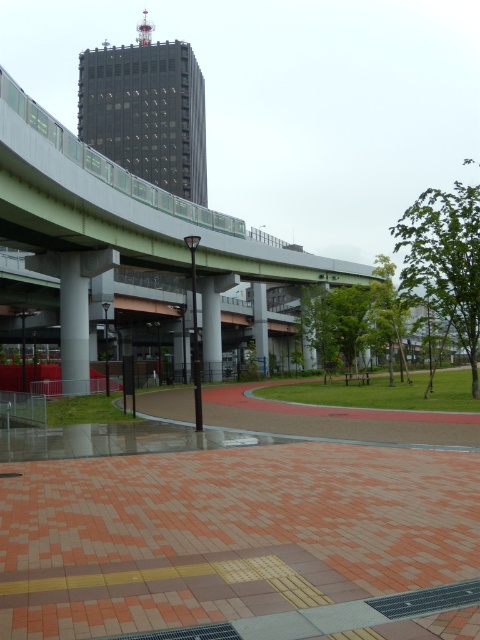
You are a city planner designing a new bike lane that needs to pass between the green concrete overpass at upper center and the white concrete pillar at center. The bike lane must be at least 10 meters wide to accommodate two cyclists side by side. Based on the scene, will the available space between these two structures allow for this requirement?

The distance between the green concrete overpass at upper center and the white concrete pillar at center is 10.15 meters, which exceeds the minimum requirement of 10 meters. Therefore, the bike lane can be safely constructed between them to accommodate two cyclists side by side.

You are a city planner reviewing this urban design. You need to install a new bench that requires a base area of 1.5 square meters. Given the brick paving at lower center and the gray concrete pillar at center, which object can accommodate the bench without overlapping?

The gray concrete pillar at center cannot accommodate the bench since it is larger than the brick paving at lower center. The brick paving at lower center is smaller than the gray concrete pillar at center, so the bench should be placed there if possible, but since the required base area is 1.5 square meters, the brick paving might not be sufficient. However, based on the given information, the question might expect selecting the larger object. Wait, the objects description says the brick paving is smaller.